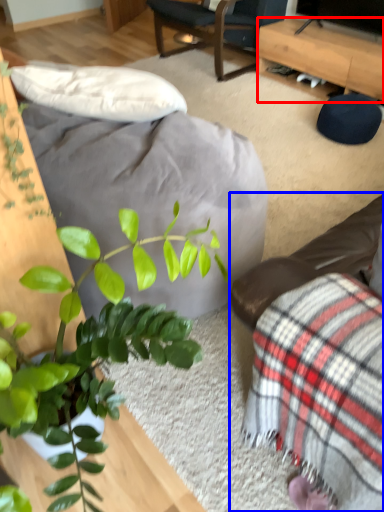
Question: Among these objects, which one is farthest to the camera, desk (highlighted by a red box) or studio couch (highlighted by a blue box)?

Choices:
 (A) desk
 (B) studio couch

Answer: (A)